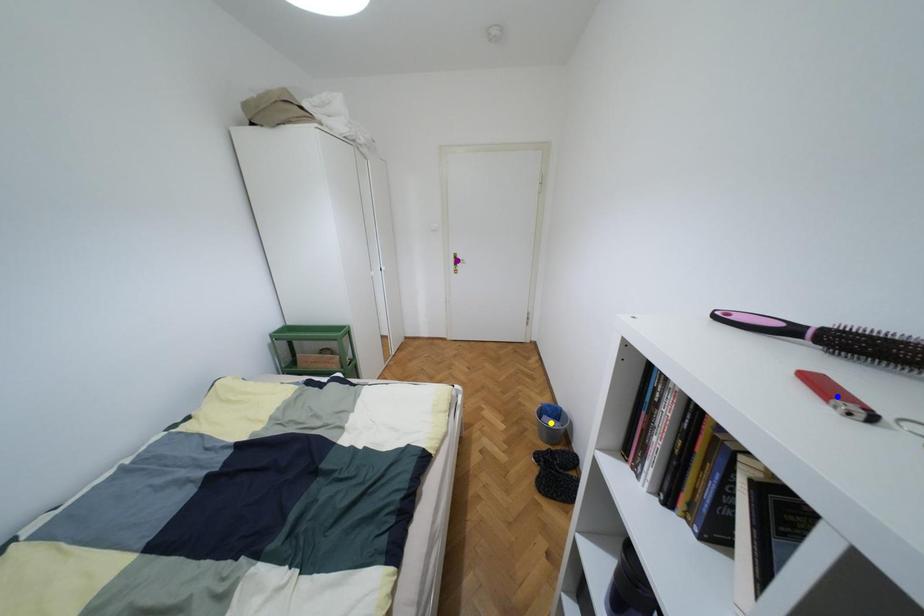
From the picture: Order these from nearest to farthest:
A) purple point
B) yellow point
C) blue point

purple point < yellow point < blue point